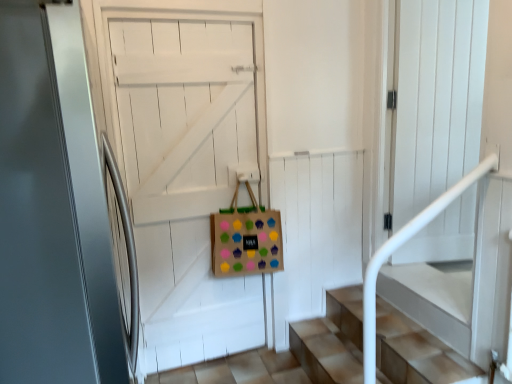
Identify the location of free space above wooden door at center, the second door from the front (from a real-world perspective). Image resolution: width=512 pixels, height=384 pixels. (183, 109).